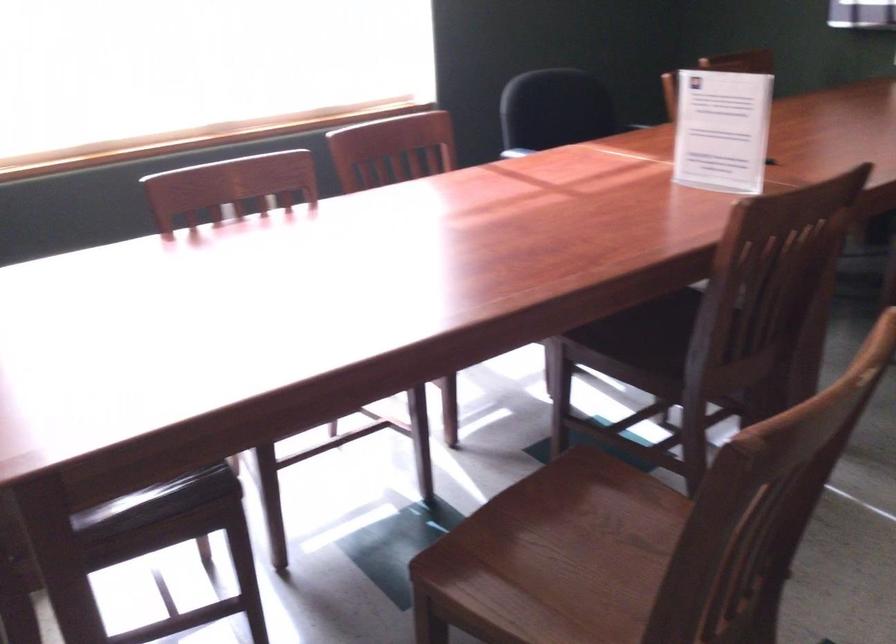
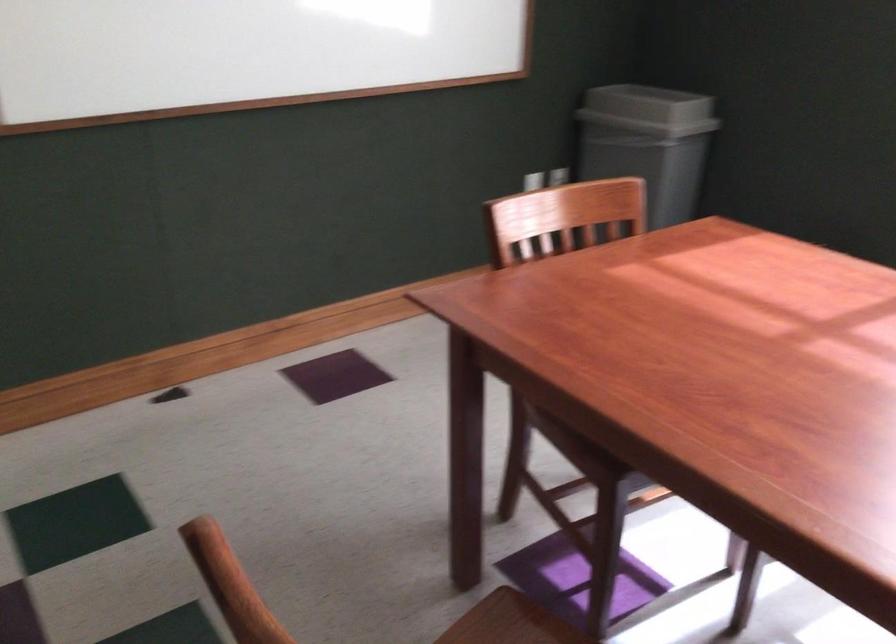
The point at (168, 532) is marked in the first image. Where is the corresponding point in the second image?

(570, 453)